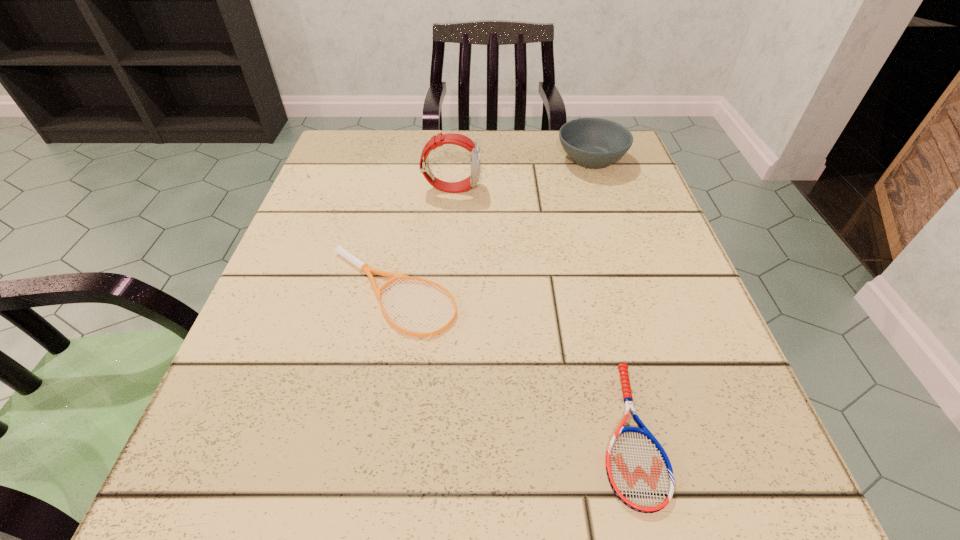
This screenshot has width=960, height=540. I want to click on watch that is at the far edge, so click(x=452, y=138).

Where is `soup bowl that is at the far edge`? The image size is (960, 540). soup bowl that is at the far edge is located at coordinates (594, 143).

Identify the location of object located in the near edge section of the desktop. The width and height of the screenshot is (960, 540). (639, 471).

You are a GUI agent. You are given a task and a screenshot of the screen. Output one action in this format:
    pyautogui.click(x=<x>, y=<y>)
    Task: Click on the object that is at the left edge
    The height and width of the screenshot is (540, 960).
    Given the screenshot: What is the action you would take?
    pyautogui.click(x=340, y=250)

Image resolution: width=960 pixels, height=540 pixels. What are the coordinates of `soup bowl that is at the right edge` in the screenshot? It's located at (594, 143).

Locate an element on the screen. tennis racket that is positioned at the right edge is located at coordinates (639, 471).

The height and width of the screenshot is (540, 960). I want to click on object positioned at the far right corner, so click(x=594, y=143).

This screenshot has width=960, height=540. Identify the location of object at the near right corner. (639, 471).

Find the location of `free space at the far edge`. free space at the far edge is located at coordinates (521, 151).

Identify the location of vacant region at the left edge. The height and width of the screenshot is (540, 960). (347, 326).